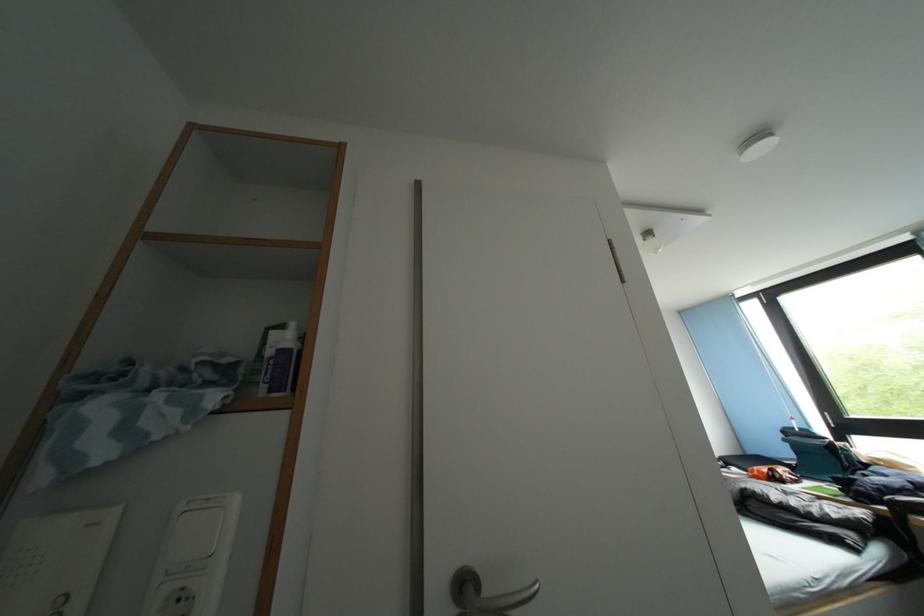
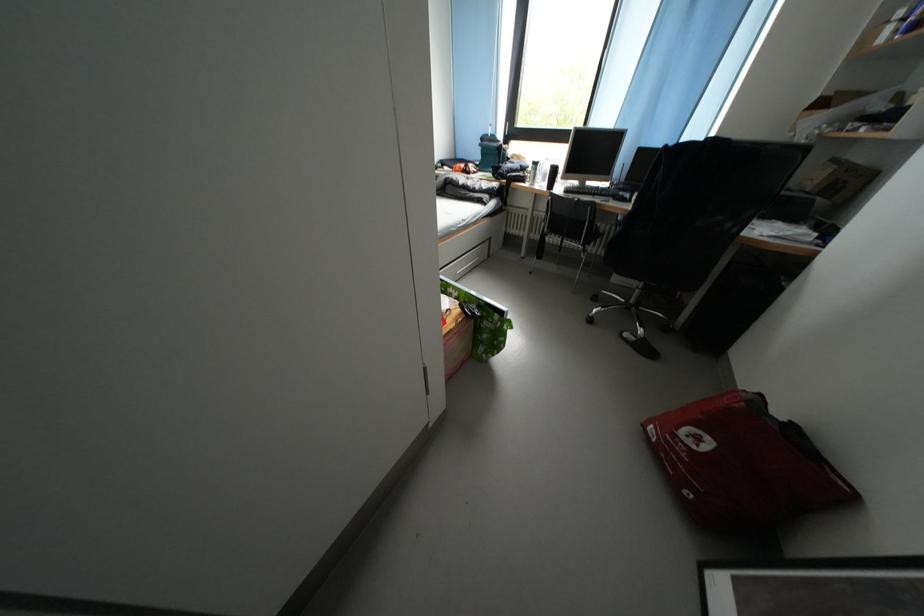
Based on the continuous images, in which direction is the camera rotating?

The rotation direction of the camera is right-down.